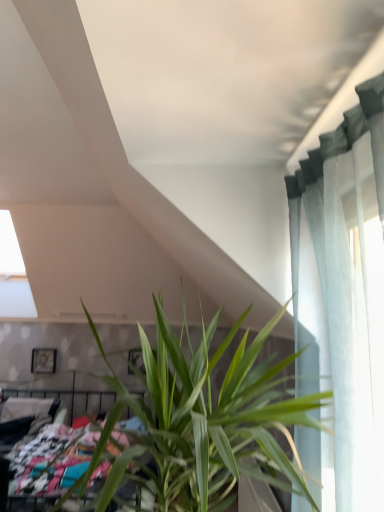
Question: Does multicolored fabric bed at lower left have a greater height compared to wooden picture frame at upper left?

Choices:
 (A) no
 (B) yes

Answer: (B)

Question: Is multicolored fabric bed at lower left shorter than wooden picture frame at upper left?

Choices:
 (A) yes
 (B) no

Answer: (B)

Question: Does multicolored fabric bed at lower left appear on the left side of wooden picture frame at upper left?

Choices:
 (A) yes
 (B) no

Answer: (B)

Question: Does multicolored fabric bed at lower left come behind wooden picture frame at upper left?

Choices:
 (A) yes
 (B) no

Answer: (B)

Question: From the image's perspective, is multicolored fabric bed at lower left on wooden picture frame at upper left?

Choices:
 (A) no
 (B) yes

Answer: (A)

Question: Is multicolored fabric bed at lower left taller or shorter than wooden picture frame at upper left?

Choices:
 (A) short
 (B) tall

Answer: (B)

Question: Based on their sizes in the image, would you say multicolored fabric bed at lower left is bigger or smaller than wooden picture frame at upper left?

Choices:
 (A) big
 (B) small

Answer: (A)

Question: Is multicolored fabric bed at lower left spatially inside wooden picture frame at upper left, or outside of it?

Choices:
 (A) outside
 (B) inside

Answer: (A)

Question: Visually, is multicolored fabric bed at lower left positioned to the left or to the right of wooden picture frame at upper left?

Choices:
 (A) left
 (B) right

Answer: (B)

Question: In the image, is wooden picture frame at upper left on the left side or the right side of multicolored fabric bed at lower left?

Choices:
 (A) right
 (B) left

Answer: (B)

Question: Considering the positions of point (54, 359) and point (59, 445), is point (54, 359) closer or farther from the camera than point (59, 445)?

Choices:
 (A) farther
 (B) closer

Answer: (A)

Question: Based on their sizes in the image, would you say wooden picture frame at upper left is bigger or smaller than multicolored fabric bed at lower left?

Choices:
 (A) small
 (B) big

Answer: (A)

Question: Is wooden picture frame at upper left wider or thinner than multicolored fabric bed at lower left?

Choices:
 (A) wide
 (B) thin

Answer: (B)

Question: From a real-world perspective, is multicolored fabric bed at lower left positioned above or below green leafy plant at center?

Choices:
 (A) below
 (B) above

Answer: (A)

Question: Is multicolored fabric bed at lower left bigger or smaller than green leafy plant at center?

Choices:
 (A) small
 (B) big

Answer: (B)